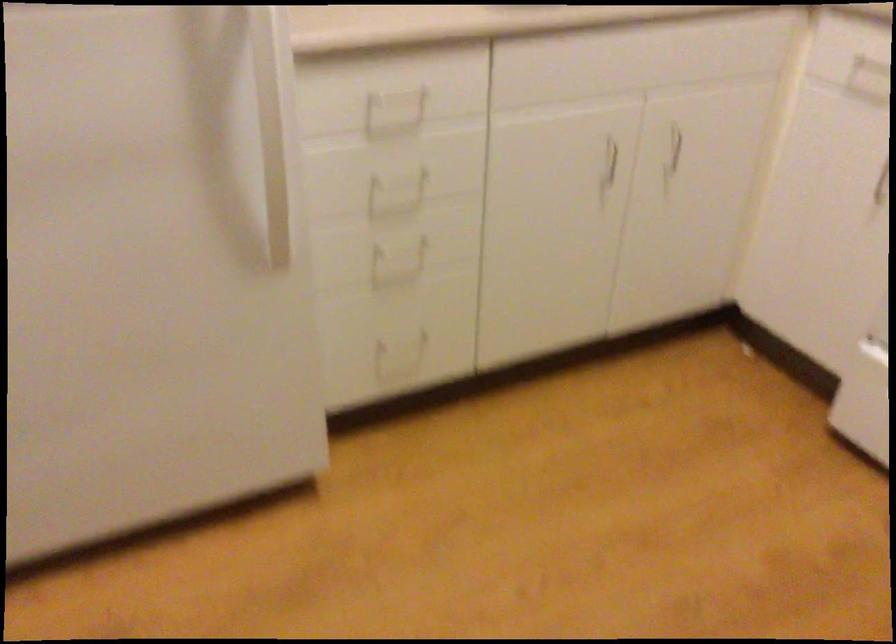
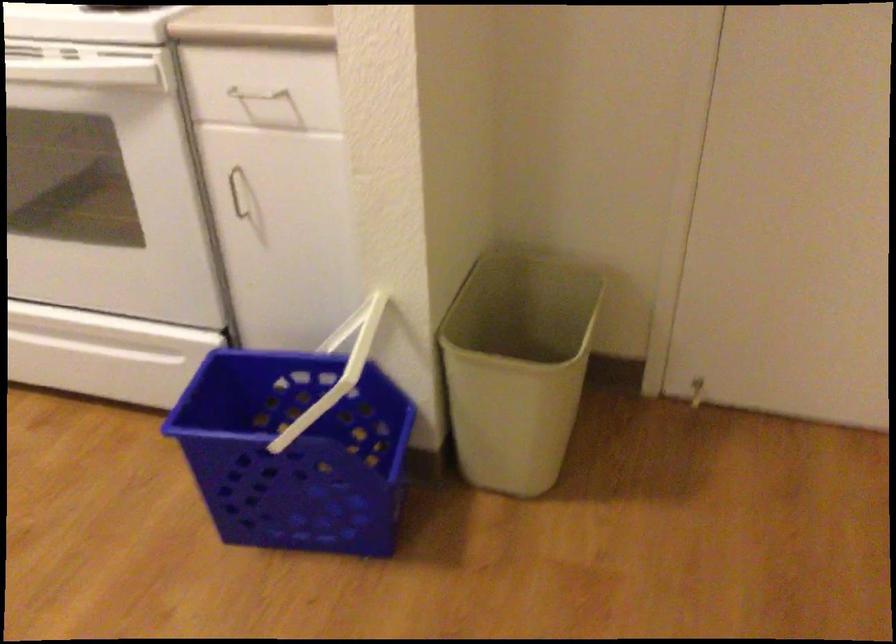
Question: The images are taken continuously from a first-person perspective. In which direction is your viewpoint rotating?

Choices:
 (A) Left
 (B) Right
 (C) Up
 (D) Down

Answer: (B)